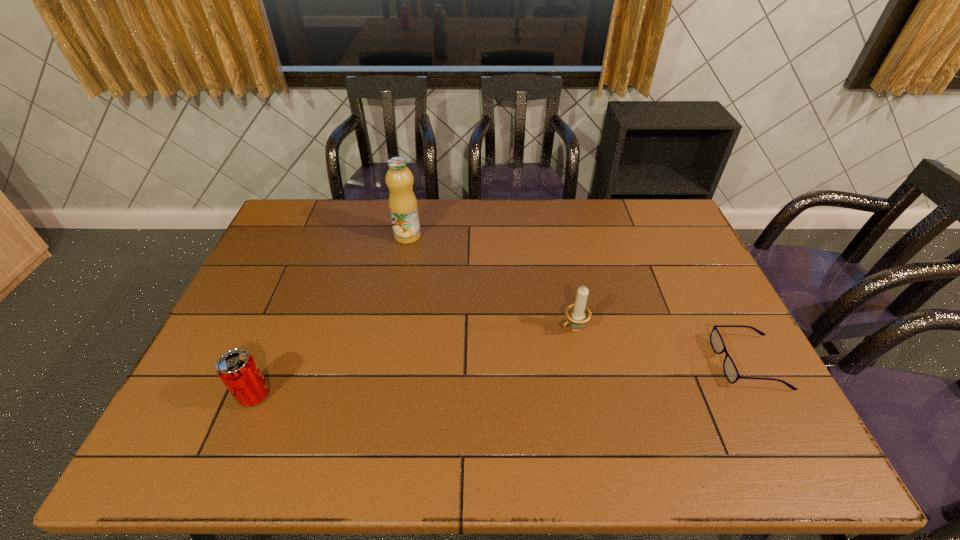
The image size is (960, 540). I want to click on vacant space at the near right corner of the desktop, so click(x=755, y=404).

This screenshot has height=540, width=960. What are the coordinates of `free space that is in between the second object from right to left and the soda can` in the screenshot? It's located at (414, 362).

Identify the location of free space between the leftmost object and the shortest object. Image resolution: width=960 pixels, height=540 pixels. (501, 379).

What are the coordinates of `free space between the leftmost object and the fruit juice` in the screenshot? It's located at (331, 316).

Find the location of a particular element. This screenshot has width=960, height=540. vacant space that is in between the third object from left to right and the leftmost object is located at coordinates (414, 362).

Identify the location of free space between the soda can and the farthest object. Image resolution: width=960 pixels, height=540 pixels. (331, 316).

The image size is (960, 540). In order to click on blank region between the fruit juice and the leftmost object in this screenshot , I will do `click(331, 316)`.

Locate which object ranks third in proximity to the rightmost object. Please provide its 2D coordinates. Your answer should be formatted as a tuple, i.e. [(x, y)], where the tuple contains the x and y coordinates of a point satisfying the conditions above.

[(237, 369)]

Identify which object is the third nearest to the soda can. Please provide its 2D coordinates. Your answer should be formatted as a tuple, i.e. [(x, y)], where the tuple contains the x and y coordinates of a point satisfying the conditions above.

[(729, 367)]

Where is `vacant point that satisfies the following two spatial constraints: 1. on the front side of the spectacles; 2. on the front-facing side of the tallest object`? vacant point that satisfies the following two spatial constraints: 1. on the front side of the spectacles; 2. on the front-facing side of the tallest object is located at coordinates (384, 363).